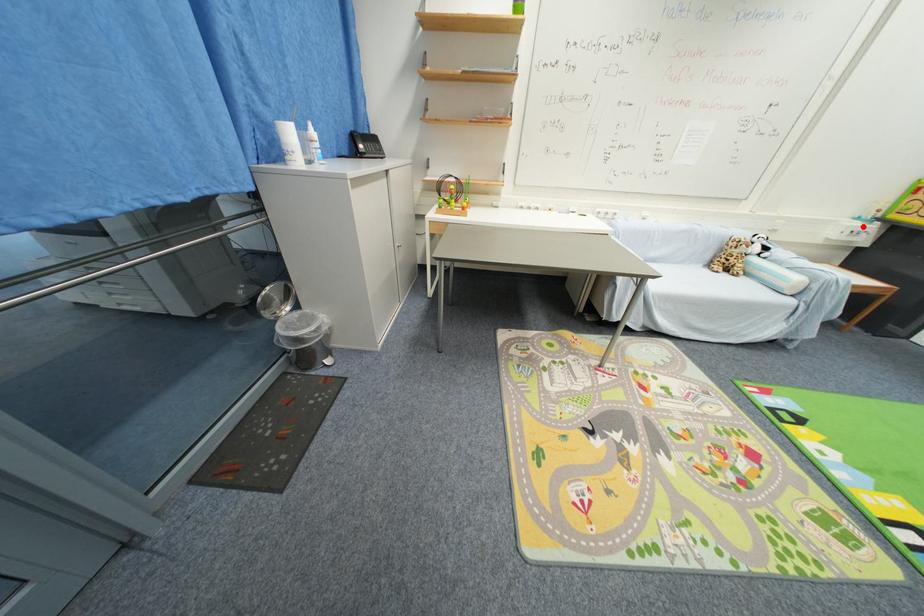
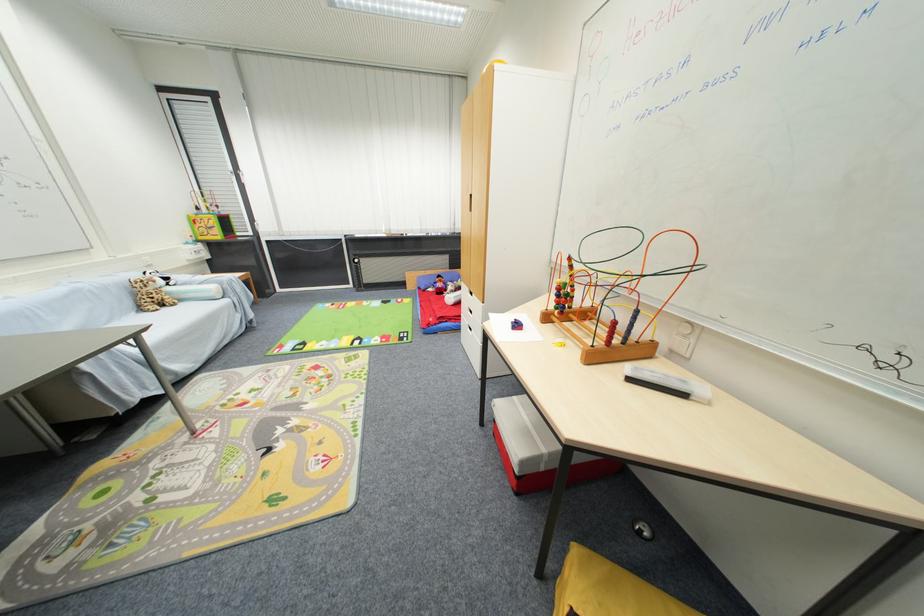
Question: I am providing you with two images of the same scene from different viewpoints. Given a red point in image1, look at the same physical point in image2. Is it:

Choices:
 (A) Closer to the viewpoint
 (B) Farther from the viewpoint

Answer: (A)